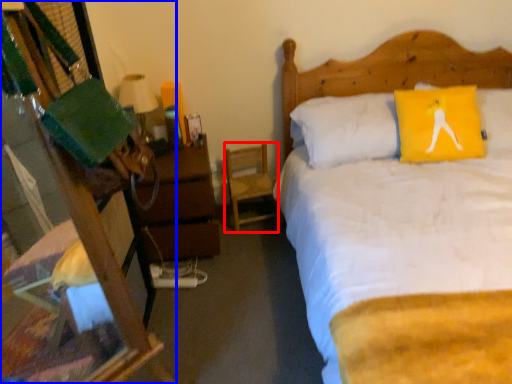
Question: Which object is closer to the camera taking this photo, chair (highlighted by a red box) or desk (highlighted by a blue box)?

Choices:
 (A) chair
 (B) desk

Answer: (B)